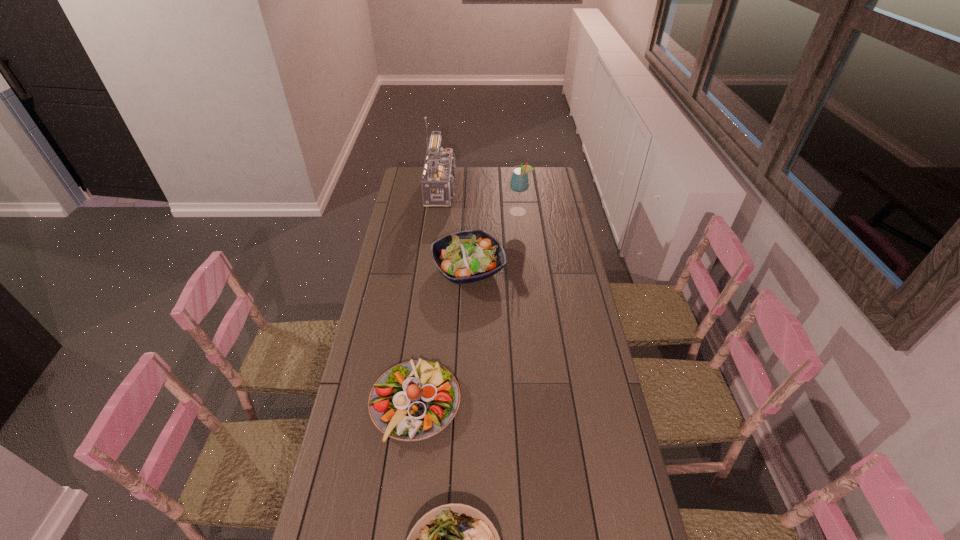
Locate an element on the screen. The image size is (960, 540). radio receiver is located at coordinates (438, 177).

The width and height of the screenshot is (960, 540). In order to click on alcohol in this screenshot , I will do `click(519, 182)`.

This screenshot has height=540, width=960. Identify the location of the second tallest object. (519, 182).

Locate an element on the screen. the third nearest object is located at coordinates (468, 256).

I want to click on the tallest salad plate, so click(468, 256).

Locate an element on the screen. This screenshot has height=540, width=960. the second nearest salad plate is located at coordinates (415, 400).

You are a GUI agent. You are given a task and a screenshot of the screen. Output one action in this format:
    pyautogui.click(x=<x>, y=<y>)
    Task: Click on the fourth tallest object
    Image resolution: width=960 pixels, height=540 pixels.
    Given the screenshot: What is the action you would take?
    pyautogui.click(x=415, y=400)

I want to click on blank space located 0.150m on the front-facing side of the radio receiver, so click(493, 190).

Locate an element on the screen. The width and height of the screenshot is (960, 540). vacant point located on the back of the rightmost object is located at coordinates coord(516,183).

Image resolution: width=960 pixels, height=540 pixels. I want to click on free location located on the front of the farthest salad plate, so click(x=468, y=303).